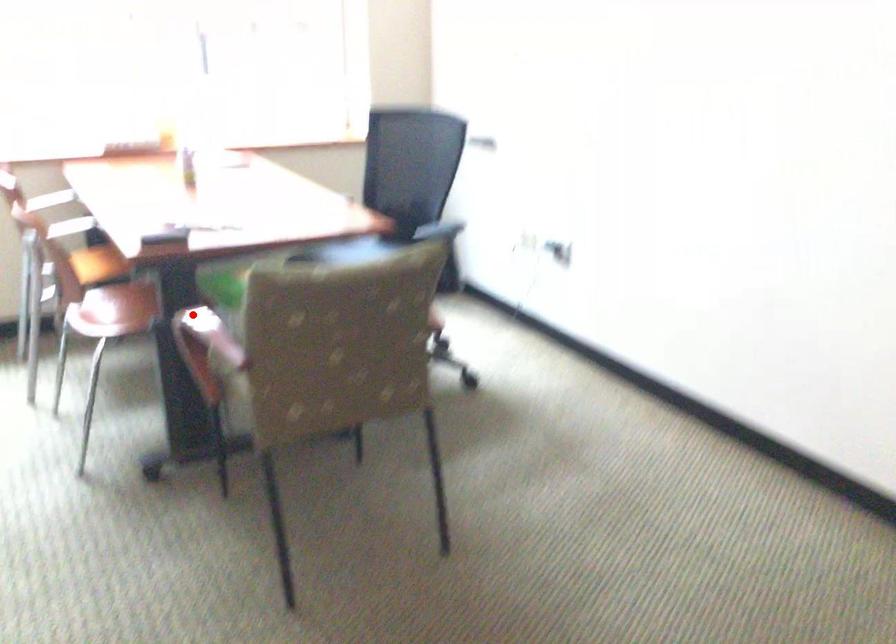
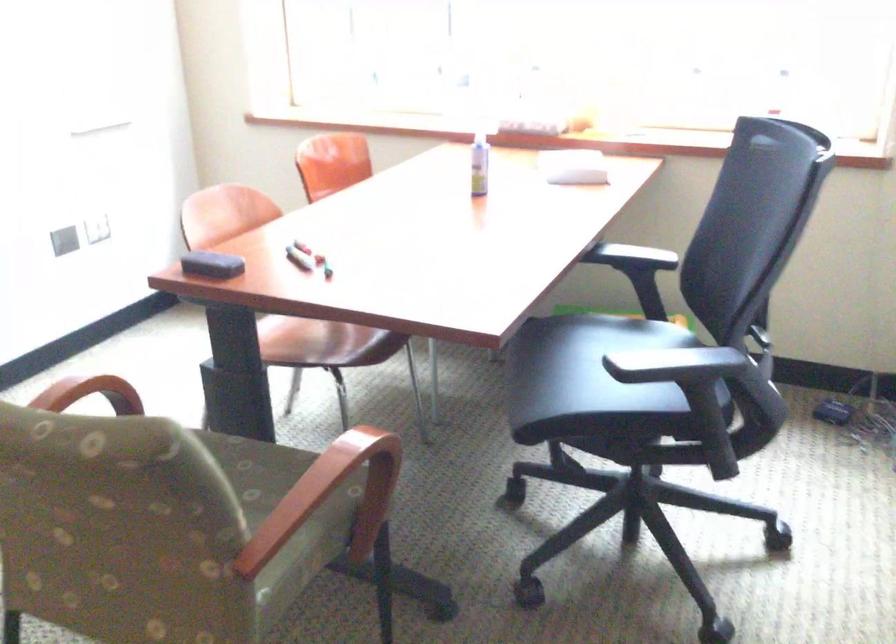
Question: A red point is marked in image1. In image2, is the corresponding 3D point closer to the camera or farther? Reply with the corresponding letter.

Choices:
 (A) The corresponding 3D point is closer.
 (B) The corresponding 3D point is farther.

Answer: (A)